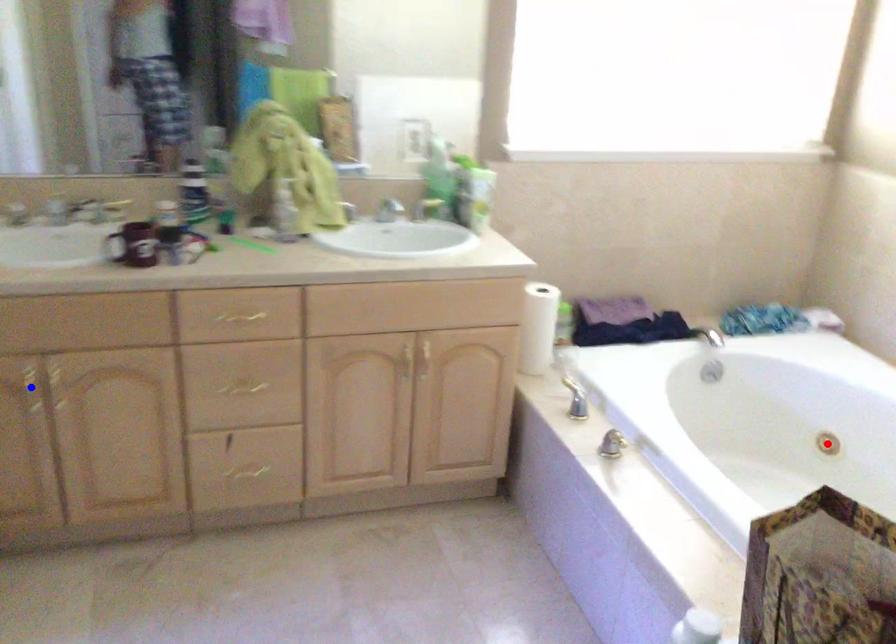
Question: In the image, two points are highlighted. Which point is nearer to the camera? Reply with the corresponding letter.

Choices:
 (A) blue point
 (B) red point

Answer: (A)